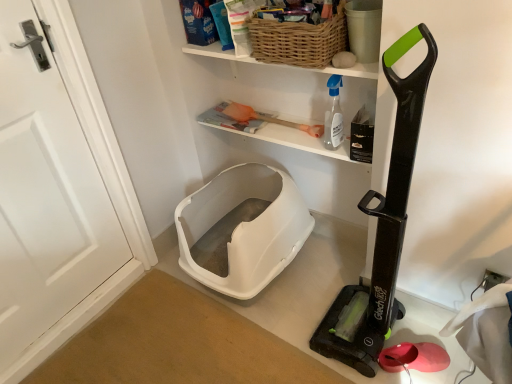
The width and height of the screenshot is (512, 384). I want to click on vacant position to the left of black plastic vacuum cleaner at right, so click(x=293, y=335).